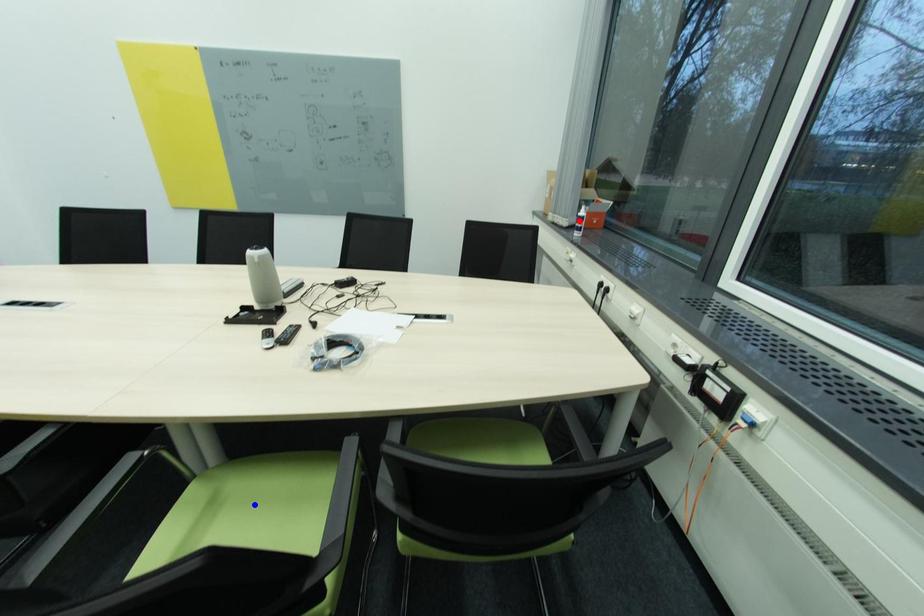
Question: In the image, two points are highlighted. Which point is nearer to the camera? Reply with the corresponding letter.

Choices:
 (A) blue point
 (B) red point

Answer: (A)